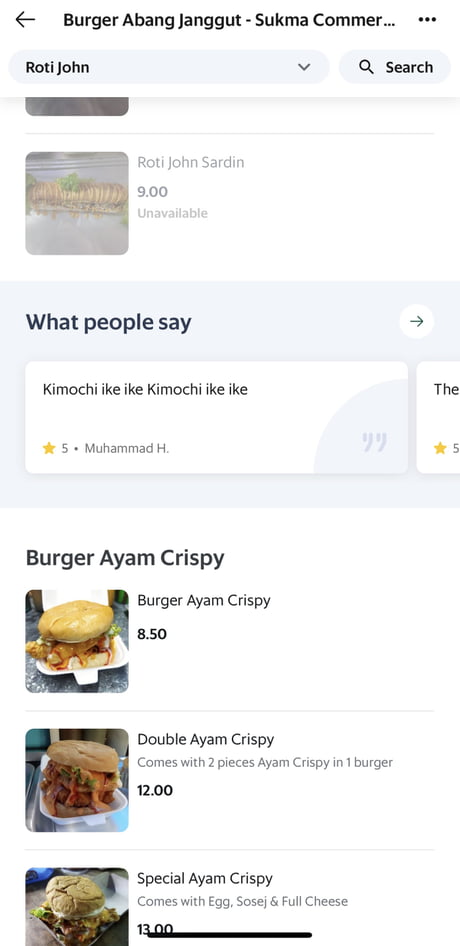
This screenshot has height=946, width=460. In order to click on metal tray in this screenshot , I will do `click(30, 818)`.